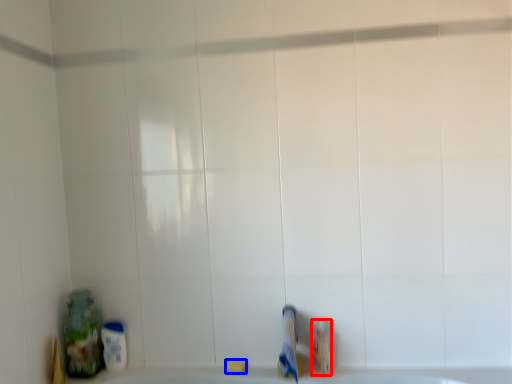
Question: Which object is closer to the camera taking this photo, toiletry (highlighted by a red box) or soap (highlighted by a blue box)?

Choices:
 (A) toiletry
 (B) soap

Answer: (A)